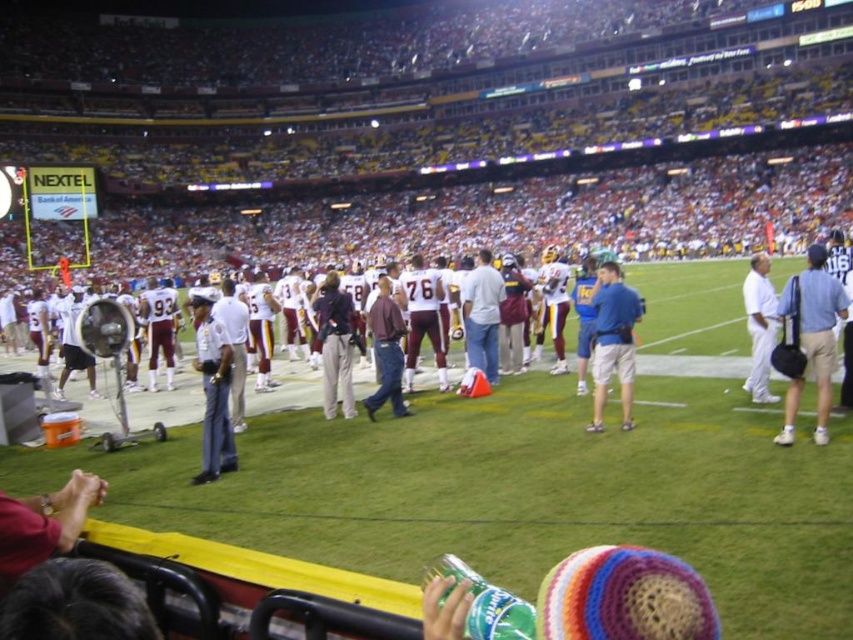
Can you confirm if light blue shirt at right is positioned to the right of blue fabric shirt at center?

Correct, you'll find light blue shirt at right to the right of blue fabric shirt at center.

Can you confirm if light blue shirt at right is wider than blue fabric shirt at center?

In fact, light blue shirt at right might be narrower than blue fabric shirt at center.

Is point (815, 374) farther from viewer compared to point (601, 380)?

No, it is in front of (601, 380).

The height and width of the screenshot is (640, 853). What are the coordinates of `light blue shirt at right` in the screenshot? It's located at (811, 337).

Can you confirm if light blue shirt at right is positioned to the left of metallic silver fan at center?

Incorrect, light blue shirt at right is not on the left side of metallic silver fan at center.

Measure the distance from light blue shirt at right to metallic silver fan at center.

8.01 meters

Describe the element at coordinates (811, 337) in the screenshot. I see `light blue shirt at right` at that location.

You are a GUI agent. You are given a task and a screenshot of the screen. Output one action in this format:
    pyautogui.click(x=<x>, y=<y>)
    Task: Click on the light blue shirt at right
    This screenshot has height=640, width=853.
    Given the screenshot: What is the action you would take?
    pyautogui.click(x=811, y=337)

Looking at this image, can you confirm if white uniform at center is shorter than maroon fabric shirt at center?

Incorrect, white uniform at center's height does not fall short of maroon fabric shirt at center's.

Does white uniform at center appear under maroon fabric shirt at center?

Correct, white uniform at center is located below maroon fabric shirt at center.

Which is in front, point (213, 422) or point (399, 378)?

Positioned in front is point (213, 422).

Where is `white uniform at center`? Image resolution: width=853 pixels, height=640 pixels. white uniform at center is located at coordinates (213, 392).